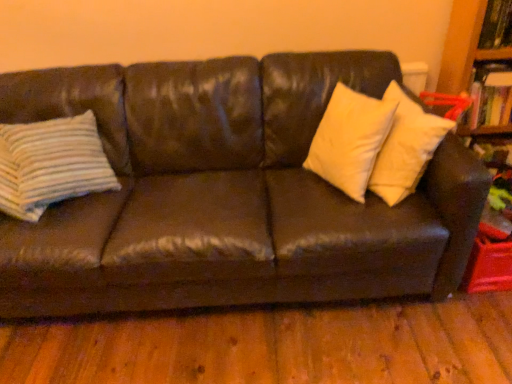
At what (x,y) coordinates should I click in order to perform the action: click on white matte pillow at upper right, which is the first pillow in right-to-left order. Please return your answer as a coordinate pair (x, y). Looking at the image, I should click on (350, 140).

Locate an element on the screen. striped fabric pillow at left, the second pillow in the right-to-left sequence is located at coordinates [x=51, y=164].

What do you see at coordinates (51, 164) in the screenshot?
I see `striped fabric pillow at left, placed as the first pillow when sorted from left to right` at bounding box center [51, 164].

In order to click on hardcover book at upper right in this screenshot , I will do `click(490, 95)`.

Can you confirm if leather couch at center is positioned to the right of hardcover book at upper right?

In fact, leather couch at center is to the left of hardcover book at upper right.

Can you tell me how much leather couch at center and hardcover book at upper right differ in facing direction?

leather couch at center and hardcover book at upper right are facing 1.24 degrees away from each other.

From the image's perspective, does leather couch at center appear higher than hardcover book at upper right?

No, from the image's perspective, leather couch at center is not above hardcover book at upper right.

Looking at this image, which is correct: leather couch at center is inside hardcover book at upper right, or outside of it?

leather couch at center exists outside the volume of hardcover book at upper right.

In the scene shown: Who is taller, wooden bookcase at upper right or hardcover book at upper right?

With more height is wooden bookcase at upper right.

Does point (507, 98) appear closer or farther from the camera than point (484, 82)?

Point (507, 98) is positioned farther from the camera compared to point (484, 82).

Which is more to the left, wooden bookcase at upper right or hardcover book at upper right?

hardcover book at upper right.

Which object is further away from the camera, hardcover book at upper right or leather couch at center?

hardcover book at upper right is more distant.

Between point (499, 91) and point (239, 295), which one is positioned behind?

Point (499, 91)

Considering the sizes of objects hardcover book at upper right and leather couch at center in the image provided, who is shorter, hardcover book at upper right or leather couch at center?

hardcover book at upper right is shorter.

Is hardcover book at upper right bigger or smaller than leather couch at center?

In the image, hardcover book at upper right appears to be smaller than leather couch at center.

Considering the relative sizes of striped fabric pillow at left, placed as the first pillow when sorted from left to right, and hardcover book at upper right in the image provided, is striped fabric pillow at left, placed as the first pillow when sorted from left to right, shorter than hardcover book at upper right?

No.

From the image's perspective, relative to hardcover book at upper right, is striped fabric pillow at left, placed as the first pillow when sorted from left to right, above or below?

Clearly, from the image's perspective, striped fabric pillow at left, placed as the first pillow when sorted from left to right, is below hardcover book at upper right.

Are striped fabric pillow at left, placed as the first pillow when sorted from left to right, and hardcover book at upper right located far from each other?

Indeed, striped fabric pillow at left, placed as the first pillow when sorted from left to right, is not near hardcover book at upper right.

How much distance is there between striped fabric pillow at left, placed as the first pillow when sorted from left to right, and hardcover book at upper right?

striped fabric pillow at left, placed as the first pillow when sorted from left to right, is 5.99 feet away from hardcover book at upper right.

Is wooden bookcase at upper right situated inside white matte pillow at upper right, which is the first pillow in right-to-left order, or outside?

wooden bookcase at upper right is not enclosed by white matte pillow at upper right, which is the first pillow in right-to-left order.

Is wooden bookcase at upper right thinner than white matte pillow at upper right, marked as the second pillow in a left-to-right arrangement?

In fact, wooden bookcase at upper right might be wider than white matte pillow at upper right, marked as the second pillow in a left-to-right arrangement.

Looking at this image, is wooden bookcase at upper right shorter than white matte pillow at upper right, marked as the second pillow in a left-to-right arrangement?

No, wooden bookcase at upper right is not shorter than white matte pillow at upper right, marked as the second pillow in a left-to-right arrangement.

Is leather couch at center placed right next to white matte pillow at upper right, marked as the second pillow in a left-to-right arrangement?

There is a gap between leather couch at center and white matte pillow at upper right, marked as the second pillow in a left-to-right arrangement.

Would you say leather couch at center is to the left or to the right of white matte pillow at upper right, which is the first pillow in right-to-left order, in the picture?

Based on their positions, leather couch at center is located to the left of white matte pillow at upper right, which is the first pillow in right-to-left order.

Who is taller, leather couch at center or white matte pillow at upper right, which is the first pillow in right-to-left order?

leather couch at center.

Which is in front, white matte pillow at upper right, marked as the second pillow in a left-to-right arrangement, or hardcover book at upper right?

white matte pillow at upper right, marked as the second pillow in a left-to-right arrangement.

Would you say white matte pillow at upper right, marked as the second pillow in a left-to-right arrangement, contains hardcover book at upper right?

No, hardcover book at upper right is not a part of white matte pillow at upper right, marked as the second pillow in a left-to-right arrangement.

The width and height of the screenshot is (512, 384). I want to click on pillow that appears above the hardcover book at upper right (from a real-world perspective), so click(x=350, y=140).

From the image's perspective, would you say white matte pillow at upper right, which is the first pillow in right-to-left order, is shown under hardcover book at upper right?

Yes, from the image's perspective, white matte pillow at upper right, which is the first pillow in right-to-left order, is beneath hardcover book at upper right.

What are the coordinates of `book located above the leather couch at center (from the image's perspective)` in the screenshot? It's located at (490, 95).

I want to click on book above the wooden bookcase at upper right (from a real-world perspective), so click(x=490, y=95).

From the image, which object appears to be farther from white matte pillow at upper right, which is the first pillow in right-to-left order, striped fabric pillow at left, placed as the first pillow when sorted from left to right, or leather couch at center?

striped fabric pillow at left, placed as the first pillow when sorted from left to right, is positioned further to the anchor white matte pillow at upper right, which is the first pillow in right-to-left order.

Estimate the real-world distances between objects in this image. Which object is closer to striped fabric pillow at left, the second pillow in the right-to-left sequence, leather couch at center or hardcover book at upper right?

leather couch at center is positioned closer to the anchor striped fabric pillow at left, the second pillow in the right-to-left sequence.

Which object lies further to the anchor point leather couch at center, wooden bookcase at upper right or white matte pillow at upper right, marked as the second pillow in a left-to-right arrangement?

Among the two, wooden bookcase at upper right is located further to leather couch at center.

Looking at the image, which one is located further to hardcover book at upper right, wooden bookcase at upper right or white matte pillow at upper right, which is the first pillow in right-to-left order?

white matte pillow at upper right, which is the first pillow in right-to-left order, is positioned further to the anchor hardcover book at upper right.

From the image, which object appears to be nearer to wooden bookcase at upper right, white matte pillow at upper right, which is the first pillow in right-to-left order, or striped fabric pillow at left, the second pillow in the right-to-left sequence?

white matte pillow at upper right, which is the first pillow in right-to-left order, lies closer to wooden bookcase at upper right than the other object.

Looking at the image, which one is located closer to hardcover book at upper right, white matte pillow at upper right, marked as the second pillow in a left-to-right arrangement, or striped fabric pillow at left, the second pillow in the right-to-left sequence?

white matte pillow at upper right, marked as the second pillow in a left-to-right arrangement, is positioned closer to the anchor hardcover book at upper right.

Based on their spatial positions, is leather couch at center or wooden bookcase at upper right further from hardcover book at upper right?

leather couch at center is positioned further to the anchor hardcover book at upper right.

Looking at the image, which one is located further to leather couch at center, hardcover book at upper right or white matte pillow at upper right, which is the first pillow in right-to-left order?

hardcover book at upper right is further to leather couch at center.

What are the coordinates of `studio couch located between striped fabric pillow at left, the second pillow in the right-to-left sequence, and hardcover book at upper right in the left-right direction` in the screenshot? It's located at (227, 194).

The height and width of the screenshot is (384, 512). I want to click on studio couch between striped fabric pillow at left, the second pillow in the right-to-left sequence, and wooden bookcase at upper right, so click(227, 194).

This screenshot has height=384, width=512. Find the location of `pillow situated between striped fabric pillow at left, the second pillow in the right-to-left sequence, and hardcover book at upper right from left to right`. pillow situated between striped fabric pillow at left, the second pillow in the right-to-left sequence, and hardcover book at upper right from left to right is located at coordinates (350, 140).

In order to click on pillow situated between leather couch at center and wooden bookcase at upper right from left to right in this screenshot , I will do `click(350, 140)`.